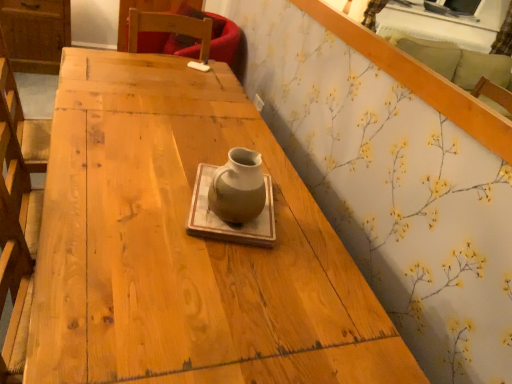
Question: Considering the positions of point (502, 157) and point (227, 157), is point (502, 157) closer or farther from the camera than point (227, 157)?

Choices:
 (A) closer
 (B) farther

Answer: (B)

Question: From the image's perspective, relative to matte ceramic vase at center, is white floral wallpaper at upper right above or below?

Choices:
 (A) above
 (B) below

Answer: (A)

Question: Is white floral wallpaper at upper right inside or outside of matte ceramic vase at center?

Choices:
 (A) outside
 (B) inside

Answer: (A)

Question: In terms of size, does matte ceramic vase at center appear bigger or smaller than white floral wallpaper at upper right?

Choices:
 (A) small
 (B) big

Answer: (A)

Question: Considering the positions of matte ceramic vase at center and white floral wallpaper at upper right in the image, is matte ceramic vase at center wider or thinner than white floral wallpaper at upper right?

Choices:
 (A) thin
 (B) wide

Answer: (B)

Question: Is point (251, 160) positioned closer to the camera than point (378, 64)?

Choices:
 (A) closer
 (B) farther

Answer: (A)

Question: In the image, is matte ceramic vase at center on the left side or the right side of white floral wallpaper at upper right?

Choices:
 (A) right
 (B) left

Answer: (B)